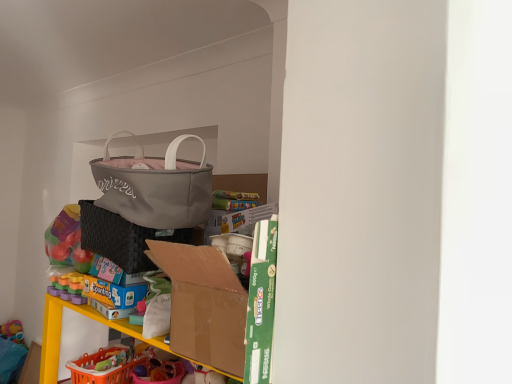
Question: Does matte gray handbag at upper center have a lesser width compared to black woven laundry basket at center?

Choices:
 (A) yes
 (B) no

Answer: (A)

Question: Is matte gray handbag at upper center completely or partially outside of black woven laundry basket at center?

Choices:
 (A) no
 (B) yes

Answer: (B)

Question: From a real-world perspective, is matte gray handbag at upper center beneath black woven laundry basket at center?

Choices:
 (A) yes
 (B) no

Answer: (B)

Question: Is matte gray handbag at upper center aimed at black woven laundry basket at center?

Choices:
 (A) yes
 (B) no

Answer: (B)

Question: Is matte gray handbag at upper center facing away from black woven laundry basket at center?

Choices:
 (A) yes
 (B) no

Answer: (B)

Question: From a real-world perspective, is matte gray handbag at upper center positioned above or below cardboard box at center?

Choices:
 (A) above
 (B) below

Answer: (A)

Question: Is matte gray handbag at upper center in front of or behind cardboard box at center in the image?

Choices:
 (A) behind
 (B) front

Answer: (A)

Question: From the image's perspective, is matte gray handbag at upper center positioned above or below cardboard box at center?

Choices:
 (A) below
 (B) above

Answer: (B)

Question: Is matte gray handbag at upper center situated inside cardboard box at center or outside?

Choices:
 (A) outside
 (B) inside

Answer: (A)

Question: Considering the positions of point (208, 248) and point (89, 231), is point (208, 248) closer or farther from the camera than point (89, 231)?

Choices:
 (A) closer
 (B) farther

Answer: (A)

Question: In terms of width, does cardboard box at center look wider or thinner when compared to black woven laundry basket at center?

Choices:
 (A) thin
 (B) wide

Answer: (A)

Question: From the image's perspective, relative to black woven laundry basket at center, is cardboard box at center above or below?

Choices:
 (A) below
 (B) above

Answer: (A)

Question: Is cardboard box at center to the left or to the right of black woven laundry basket at center in the image?

Choices:
 (A) right
 (B) left

Answer: (A)

Question: Is point [x=141, y=190] positioned closer to the camera than point [x=129, y=241]?

Choices:
 (A) farther
 (B) closer

Answer: (B)

Question: In terms of height, does matte gray handbag at upper center look taller or shorter compared to black woven laundry basket at center?

Choices:
 (A) short
 (B) tall

Answer: (B)